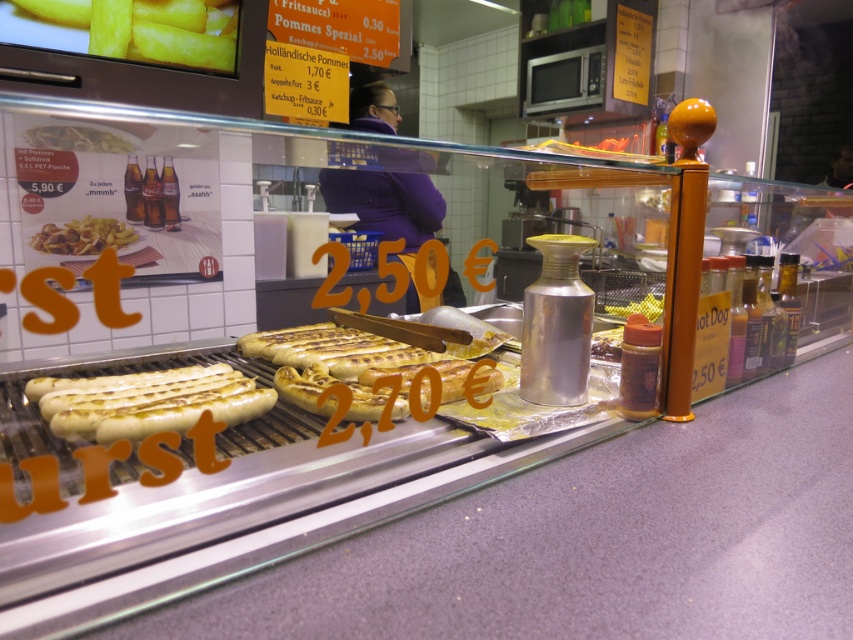
Does yellow matte fries at upper left have a larger size compared to yellow plastic mustard at right?

Yes.

Who is more distant from viewer, (x=219, y=48) or (x=647, y=294)?

Point (x=219, y=48)

The image size is (853, 640). Identify the location of yellow matte fries at upper left. (128, 29).

At what (x,y) coordinates should I click in order to perform the action: click on golden grilled sausage at center. Please return your answer as a coordinate pair (x, y). This screenshot has width=853, height=640. Looking at the image, I should click on (154, 404).

Can you confirm if golden grilled sausage at center is positioned to the left of yellow plastic mustard at right?

Indeed, golden grilled sausage at center is positioned on the left side of yellow plastic mustard at right.

Identify the location of golden grilled sausage at center. The width and height of the screenshot is (853, 640). (154, 404).

Can you confirm if golden grilled sausage at center is smaller than golden crispy fries at left?

Incorrect, golden grilled sausage at center is not smaller in size than golden crispy fries at left.

Can you confirm if golden grilled sausage at center is taller than golden crispy fries at left?

No.

Who is more distant from viewer, (206, 365) or (59, 237)?

The point (59, 237) is behind.

Where is `golden grilled sausage at center`? golden grilled sausage at center is located at coordinates (154, 404).